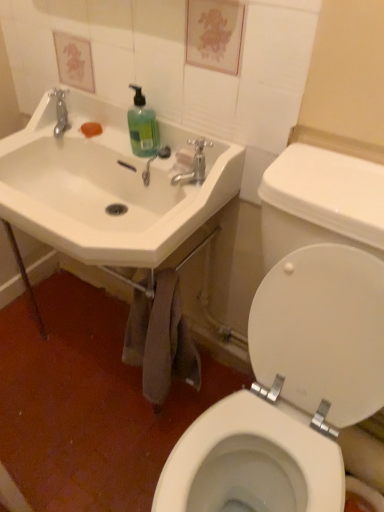
Question: From the image's perspective, is translucent plastic faucet at upper center on top of white ceramic sink at upper left?

Choices:
 (A) yes
 (B) no

Answer: (A)

Question: Is translucent plastic faucet at upper center far away from white ceramic sink at upper left?

Choices:
 (A) yes
 (B) no

Answer: (B)

Question: Does translucent plastic faucet at upper center come in front of white ceramic sink at upper left?

Choices:
 (A) yes
 (B) no

Answer: (B)

Question: Considering the relative sizes of translucent plastic faucet at upper center and white ceramic sink at upper left in the image provided, is translucent plastic faucet at upper center wider than white ceramic sink at upper left?

Choices:
 (A) yes
 (B) no

Answer: (B)

Question: Does translucent plastic faucet at upper center appear on the right side of white ceramic sink at upper left?

Choices:
 (A) yes
 (B) no

Answer: (A)

Question: Can you confirm if translucent plastic faucet at upper center is shorter than white ceramic sink at upper left?

Choices:
 (A) yes
 (B) no

Answer: (A)

Question: Does white ceramic sink at upper left have a lesser width compared to translucent plastic faucet at upper center?

Choices:
 (A) yes
 (B) no

Answer: (B)

Question: Can you confirm if white ceramic sink at upper left is shorter than translucent plastic faucet at upper center?

Choices:
 (A) yes
 (B) no

Answer: (B)

Question: Can you confirm if white ceramic sink at upper left is smaller than translucent plastic faucet at upper center?

Choices:
 (A) no
 (B) yes

Answer: (A)

Question: Considering the relative sizes of white ceramic sink at upper left and translucent plastic faucet at upper center in the image provided, is white ceramic sink at upper left taller than translucent plastic faucet at upper center?

Choices:
 (A) no
 (B) yes

Answer: (B)

Question: Is white ceramic sink at upper left oriented towards translucent plastic faucet at upper center?

Choices:
 (A) yes
 (B) no

Answer: (A)

Question: From the image's perspective, would you say white ceramic sink at upper left is positioned over translucent plastic faucet at upper center?

Choices:
 (A) yes
 (B) no

Answer: (B)

Question: Is white glossy toilet lid at right taller than matte silver faucet at upper center?

Choices:
 (A) no
 (B) yes

Answer: (B)